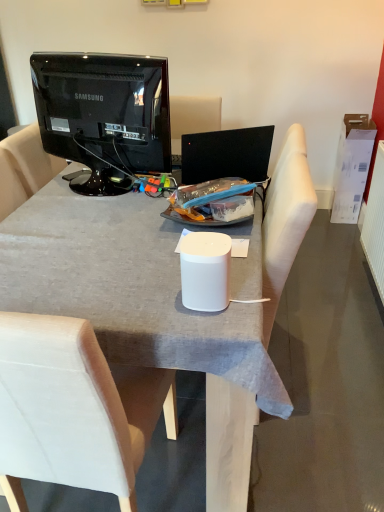
You are a GUI agent. You are given a task and a screenshot of the screen. Output one action in this format:
    pyautogui.click(x=<x>, y=<y>)
    Task: Click on the empty space that is to the right of white matte smart speaker at center
    
    Given the screenshot: What is the action you would take?
    pyautogui.click(x=246, y=295)